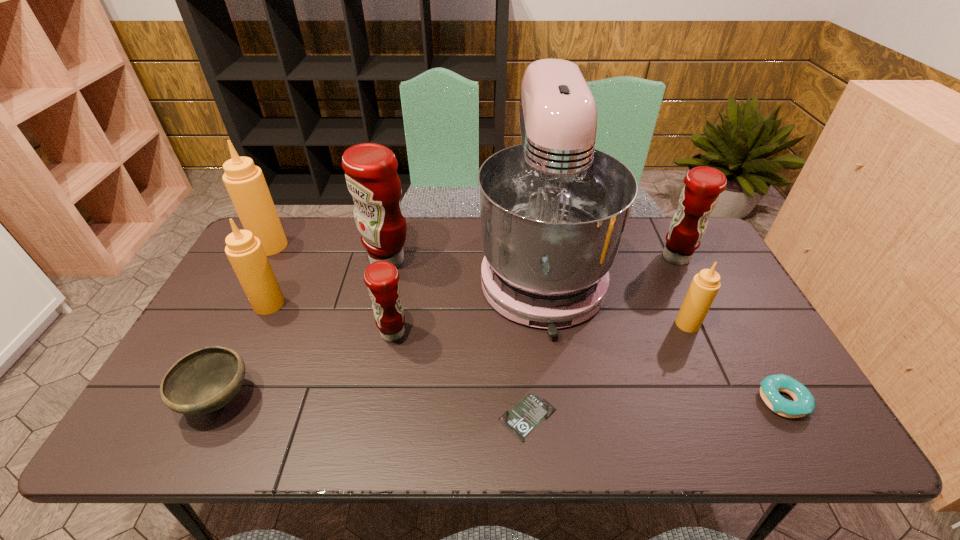
Image resolution: width=960 pixels, height=540 pixels. Find the location of `the shortest object`. the shortest object is located at coordinates [524, 417].

At what (x,y) coordinates should I click in order to perform the action: click on blank space located 0.200m on the front-facing side of the pink mixer. Please return your answer as a coordinate pair (x, y). Looking at the image, I should click on (562, 412).

At what (x,y) coordinates should I click in order to perform the action: click on free location located 0.050m on the back of the biggest tan condiment. Please return your answer as a coordinate pair (x, y). This screenshot has height=540, width=960. Looking at the image, I should click on (281, 227).

Image resolution: width=960 pixels, height=540 pixels. Identify the location of vacant space located on the right of the biggest red condiment. (506, 261).

This screenshot has width=960, height=540. What are the coordinates of `vacant space situated on the back of the rightmost red condiment` in the screenshot? It's located at (664, 232).

In order to click on vacant space located on the back of the second smallest tan condiment in this screenshot , I will do `click(293, 254)`.

Image resolution: width=960 pixels, height=540 pixels. Find the location of `free spot located 0.130m on the right of the smallest tan condiment`. free spot located 0.130m on the right of the smallest tan condiment is located at coordinates (746, 324).

Image resolution: width=960 pixels, height=540 pixels. Find the location of `free space located 0.300m on the left of the smallest red condiment`. free space located 0.300m on the left of the smallest red condiment is located at coordinates (266, 333).

Locate an element on the screen. vacant space located 0.280m on the back of the bowl is located at coordinates (272, 292).

This screenshot has width=960, height=540. In order to click on free location located 0.310m on the back of the doughnut in this screenshot , I will do `click(721, 292)`.